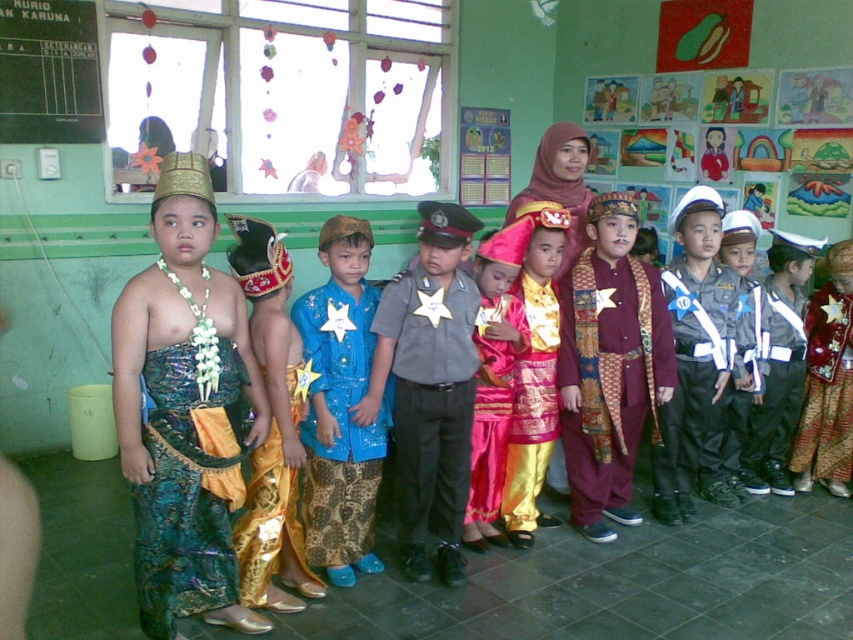
Who is positioned more to the left, gold satin robe at center or light gray uniform at center?

gold satin robe at center

Between gold satin robe at center and light gray uniform at center, which one has more height?

With more height is light gray uniform at center.

You are a GUI agent. You are given a task and a screenshot of the screen. Output one action in this format:
    pyautogui.click(x=<x>, y=<y>)
    Task: Click on the gold satin robe at center
    
    Given the screenshot: What is the action you would take?
    pyautogui.click(x=532, y=404)

Is shiny gold pants at center wider than shiny gold fabric at center?

Indeed, shiny gold pants at center has a greater width compared to shiny gold fabric at center.

Does shiny gold pants at center appear under shiny gold fabric at center?

Incorrect, shiny gold pants at center is not positioned below shiny gold fabric at center.

Which is behind, point (276, 518) or point (473, 474)?

The point (473, 474) is more distant.

Where is `shiny gold pants at center`? The image size is (853, 640). shiny gold pants at center is located at coordinates (271, 426).

In the scene shown: Which of these two, shiny blue uniform at center or shiny gold fabric at center, stands shorter?

shiny gold fabric at center is shorter.

Is shiny blue uniform at center shorter than shiny gold fabric at center?

In fact, shiny blue uniform at center may be taller than shiny gold fabric at center.

Is point (706, 344) positioned before point (498, 305)?

That is False.

I want to click on shiny blue uniform at center, so click(694, 348).